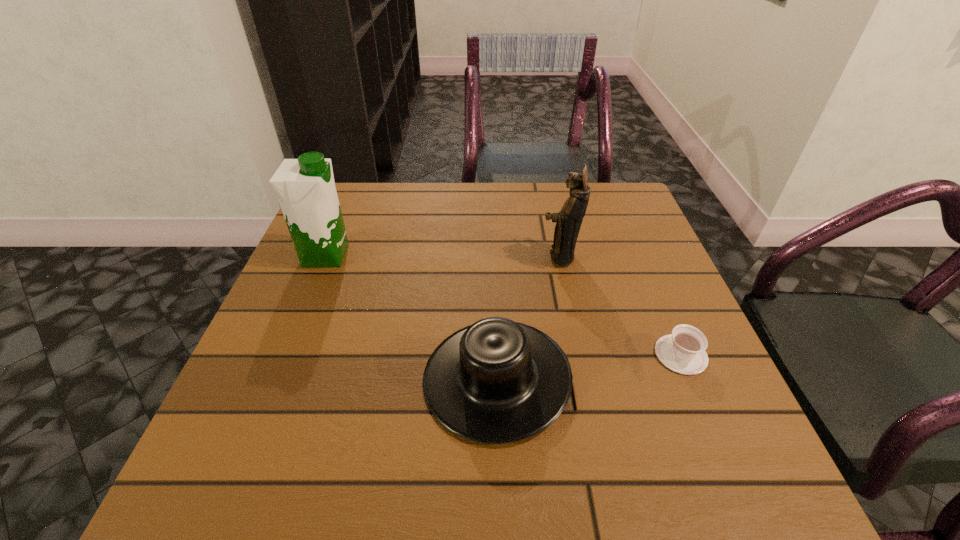
Where is `free space located on the handle side of the teacup`? This screenshot has height=540, width=960. free space located on the handle side of the teacup is located at coordinates click(656, 295).

Locate an element on the screen. The image size is (960, 540). vacant space situated 0.190m on the handle side of the teacup is located at coordinates (645, 271).

Where is `vacant space located on the handle side of the teacup`? This screenshot has height=540, width=960. vacant space located on the handle side of the teacup is located at coordinates (625, 222).

Where is `object located in the near edge section of the desktop`? This screenshot has width=960, height=540. object located in the near edge section of the desktop is located at coordinates (497, 381).

The height and width of the screenshot is (540, 960). What are the coordinates of `object located at the left edge` in the screenshot? It's located at (305, 187).

Identify the location of object that is at the right edge. The height and width of the screenshot is (540, 960). (683, 351).

In the image, there is a desktop. At what (x,y) coordinates should I click in order to perform the action: click on vacant region at the far edge. Please return your answer as a coordinate pair (x, y). The width and height of the screenshot is (960, 540). Looking at the image, I should click on (386, 201).

I want to click on vacant space at the near edge, so click(509, 502).

This screenshot has height=540, width=960. What are the coordinates of `vacant space at the left edge` in the screenshot? It's located at (334, 299).

Locate an element on the screen. This screenshot has height=540, width=960. free region at the right edge of the desktop is located at coordinates coord(595,267).